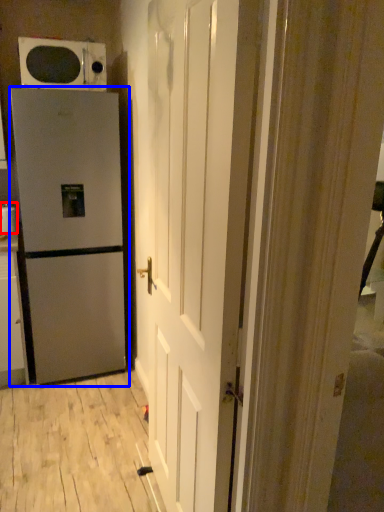
Question: Which of the following is the closest to the observer, appliance (highlighted by a red box) or refrigerator (highlighted by a blue box)?

Choices:
 (A) appliance
 (B) refrigerator

Answer: (B)